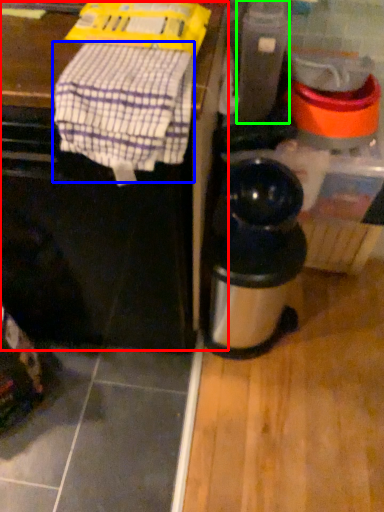
Question: Which object is the closest to the vanity (highlighted by a red box)? Choose among these: blanket (highlighted by a blue box) or appliance (highlighted by a green box).

Choices:
 (A) blanket
 (B) appliance

Answer: (A)